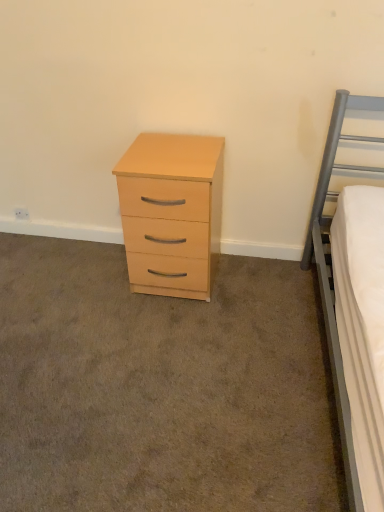
Describe the element at coordinates (171, 212) in the screenshot. I see `light wood/veneer chest of drawers at center` at that location.

Locate an element on the screen. light wood/veneer chest of drawers at center is located at coordinates (171, 212).

The image size is (384, 512). What do you see at coordinates (162, 387) in the screenshot?
I see `light wood drawer at center` at bounding box center [162, 387].

Identify the location of light wood drawer at center. (162, 387).

Image resolution: width=384 pixels, height=512 pixels. In order to click on light wood/veneer chest of drawers at center in this screenshot , I will do `click(171, 212)`.

Between light wood drawer at center and light wood/veneer chest of drawers at center, which one appears on the left side from the viewer's perspective?

light wood drawer at center is more to the left.

From the picture: Considering their positions, is light wood drawer at center located in front of or behind light wood/veneer chest of drawers at center?

Clearly, light wood drawer at center is in front of light wood/veneer chest of drawers at center.

Considering the positions of points (111, 479) and (147, 281), is point (111, 479) closer to camera compared to point (147, 281)?

Yes, it is.

From the image's perspective, relative to light wood/veneer chest of drawers at center, is light wood drawer at center above or below?

Clearly, from the image's perspective, light wood drawer at center is below light wood/veneer chest of drawers at center.

From a real-world perspective, between light wood drawer at center and light wood/veneer chest of drawers at center, who is vertically lower?

light wood drawer at center, from a real-world perspective.

Can you confirm if light wood drawer at center is wider than light wood/veneer chest of drawers at center?

Correct, the width of light wood drawer at center exceeds that of light wood/veneer chest of drawers at center.

Considering the relative sizes of light wood drawer at center and light wood/veneer chest of drawers at center in the image provided, is light wood drawer at center shorter than light wood/veneer chest of drawers at center?

Yes, light wood drawer at center is shorter than light wood/veneer chest of drawers at center.

Looking at the image, does light wood drawer at center seem bigger or smaller compared to light wood/veneer chest of drawers at center?

Clearly, light wood drawer at center is smaller in size than light wood/veneer chest of drawers at center.

Is light wood/veneer chest of drawers at center inside light wood drawer at center?

That's incorrect, light wood/veneer chest of drawers at center is not inside light wood drawer at center.

Is the surface of light wood drawer at center in direct contact with light wood/veneer chest of drawers at center?

No, light wood drawer at center is not making contact with light wood/veneer chest of drawers at center.

Is light wood/veneer chest of drawers at center at the back of light wood drawer at center?

That's not correct — light wood drawer at center is not looking away from light wood/veneer chest of drawers at center.

How different are the orientations of light wood drawer at center and light wood/veneer chest of drawers at center in degrees?

The angle between the facing direction of light wood drawer at center and the facing direction of light wood/veneer chest of drawers at center is 89.3 degrees.

I want to click on plain below the light wood/veneer chest of drawers at center (from a real-world perspective), so click(162, 387).

Considering the positions of objects light wood/veneer chest of drawers at center and light wood drawer at center in the image provided, who is more to the right, light wood/veneer chest of drawers at center or light wood drawer at center?

Positioned to the right is light wood/veneer chest of drawers at center.

Which object is closer to the camera taking this photo, light wood/veneer chest of drawers at center or light wood drawer at center?

light wood drawer at center is closer to the camera.

Which is behind, point (218, 152) or point (2, 346)?

The point (218, 152) is farther.

From the image's perspective, is light wood/veneer chest of drawers at center on top of light wood drawer at center?

Yes, from the image's perspective, light wood/veneer chest of drawers at center is over light wood drawer at center.

From a real-world perspective, which object rests below the other?

In real-world perspective, light wood drawer at center is lower.

Does light wood/veneer chest of drawers at center have a lesser width compared to light wood drawer at center?

Correct, the width of light wood/veneer chest of drawers at center is less than that of light wood drawer at center.

Is light wood/veneer chest of drawers at center taller than light wood drawer at center?

Yes, light wood/veneer chest of drawers at center is taller than light wood drawer at center.

Based on their sizes in the image, would you say light wood/veneer chest of drawers at center is bigger or smaller than light wood drawer at center?

Considering their sizes, light wood/veneer chest of drawers at center takes up more space than light wood drawer at center.

Is light wood/veneer chest of drawers at center positioned beyond the bounds of light wood drawer at center?

light wood/veneer chest of drawers at center lies outside light wood drawer at center's area.

Would you say light wood/veneer chest of drawers at center is a long distance from light wood drawer at center?

light wood/veneer chest of drawers at center is near light wood drawer at center, not far away.

Is light wood/veneer chest of drawers at center oriented towards light wood drawer at center?

Yes, light wood/veneer chest of drawers at center is oriented towards light wood drawer at center.

Locate an element on the screen. The height and width of the screenshot is (512, 384). chest of drawers to the right of light wood drawer at center is located at coordinates (171, 212).

Locate an element on the screen. The height and width of the screenshot is (512, 384). the chest of drawers behind the light wood drawer at center is located at coordinates (171, 212).

Find the location of `plain located underneath the light wood/veneer chest of drawers at center (from a real-world perspective)`. plain located underneath the light wood/veneer chest of drawers at center (from a real-world perspective) is located at coordinates (162, 387).